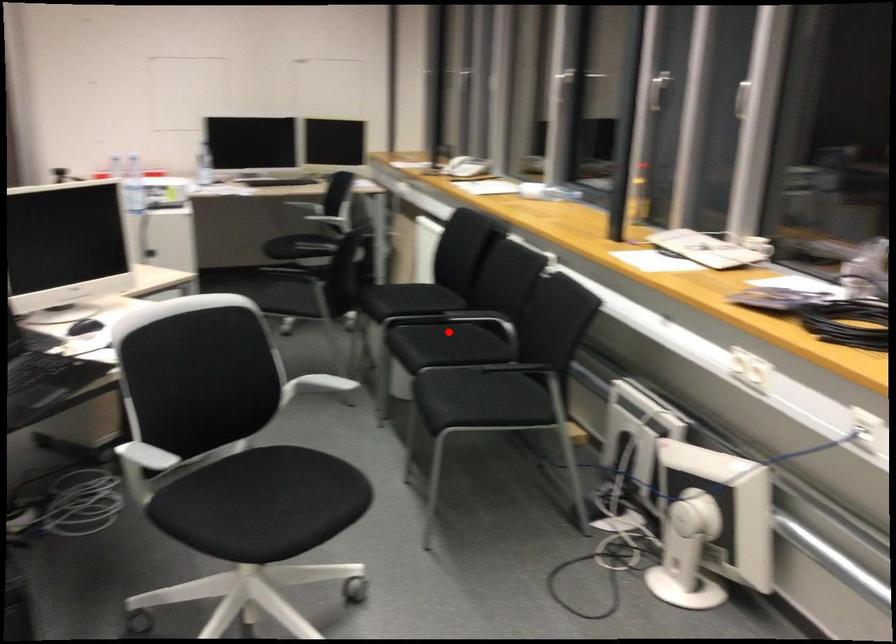
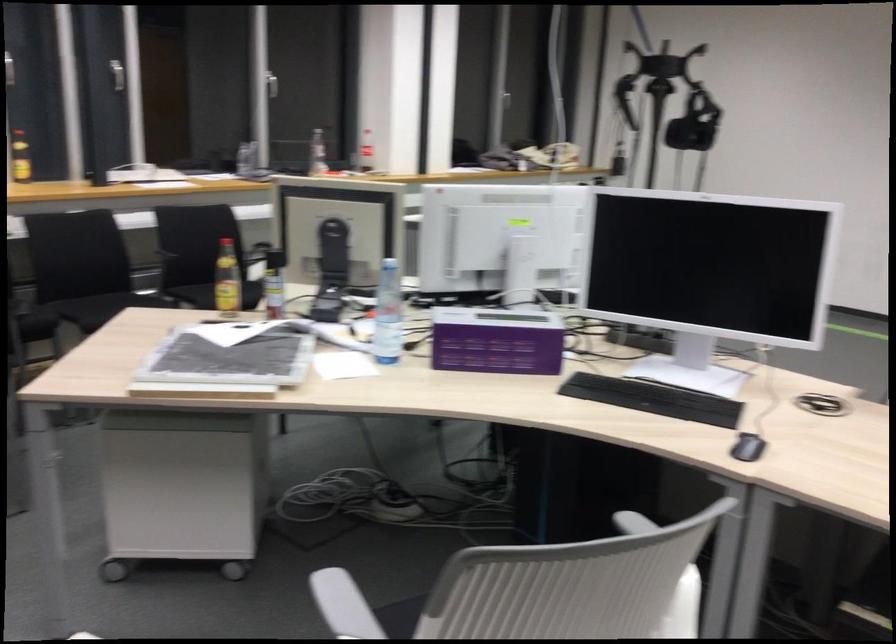
Find the pixel in the second image that matches the highlighted location in the first image.

(90, 310)